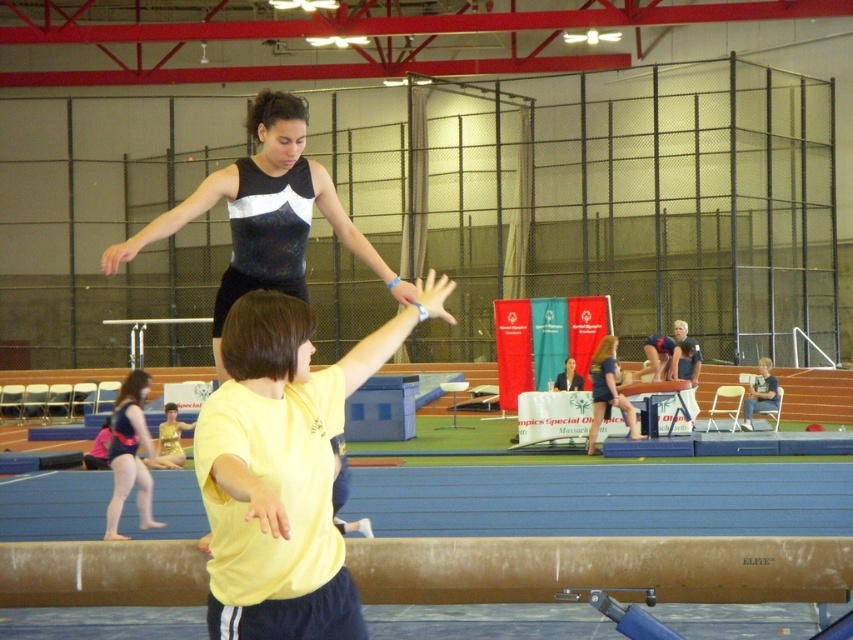
Between matte black leotard at lower left and matte blue shorts at center, which one has less height?

Standing shorter between the two is matte black leotard at lower left.

Does matte black leotard at lower left appear over matte blue shorts at center?

No, matte black leotard at lower left is not above matte blue shorts at center.

Where is `matte black leotard at lower left`? The height and width of the screenshot is (640, 853). matte black leotard at lower left is located at coordinates (131, 456).

Can you confirm if yellow matte shirt at center is positioned above sparkly black leotard at upper center?

Incorrect, yellow matte shirt at center is not positioned above sparkly black leotard at upper center.

Between point (221, 634) and point (306, 115), which one is positioned behind?

Point (306, 115)

Locate an element on the screen. The image size is (853, 640). yellow matte shirt at center is located at coordinates (283, 468).

Who is more distant from viewer, (236, 413) or (131, 483)?

The point (131, 483) is more distant.

Can you confirm if yellow matte shirt at center is shorter than matte black leotard at lower left?

Yes.

Identify the location of yellow matte shirt at center. The image size is (853, 640). (283, 468).